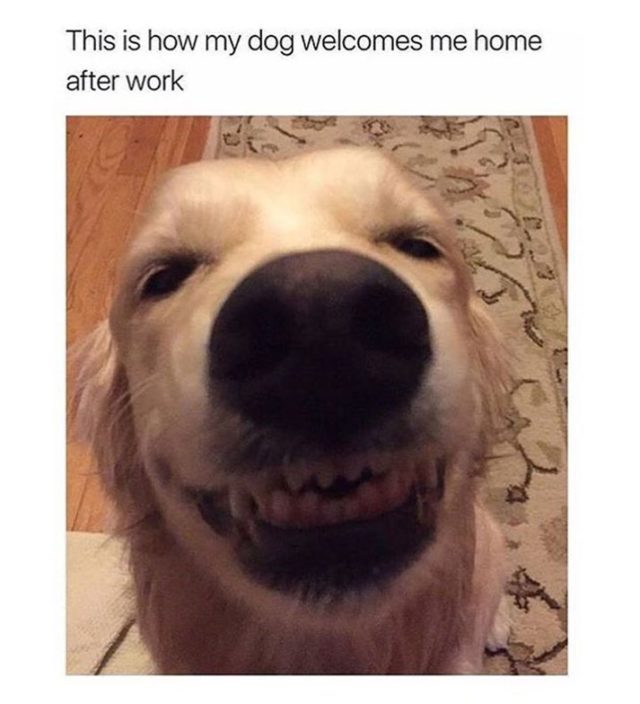
Where is `tile floor in the background`? tile floor in the background is located at coordinates click(111, 647), click(95, 562).